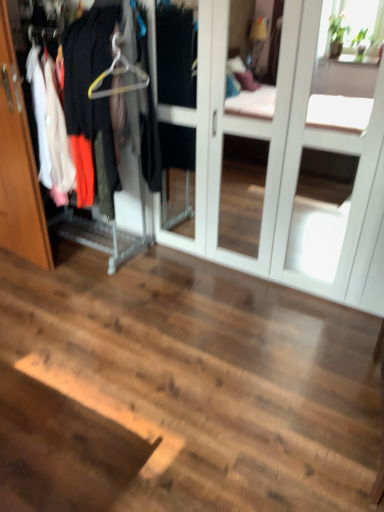
Question: Does wooden door at left have a smaller size compared to metallic hanger at left?

Choices:
 (A) no
 (B) yes

Answer: (B)

Question: Is wooden door at left at the left side of metallic hanger at left?

Choices:
 (A) yes
 (B) no

Answer: (A)

Question: Is wooden door at left positioned behind metallic hanger at left?

Choices:
 (A) no
 (B) yes

Answer: (B)

Question: From the image's perspective, is wooden door at left under metallic hanger at left?

Choices:
 (A) no
 (B) yes

Answer: (B)

Question: Does wooden door at left appear on the right side of metallic hanger at left?

Choices:
 (A) yes
 (B) no

Answer: (B)

Question: Can we say wooden door at left lies outside metallic hanger at left?

Choices:
 (A) yes
 (B) no

Answer: (A)

Question: From the image's perspective, is metallic hanger at left located beneath wooden door at left?

Choices:
 (A) yes
 (B) no

Answer: (B)

Question: Does metallic hanger at left turn towards wooden door at left?

Choices:
 (A) no
 (B) yes

Answer: (B)

Question: Does metallic hanger at left have a lesser width compared to wooden door at left?

Choices:
 (A) yes
 (B) no

Answer: (B)

Question: Is metallic hanger at left turned away from wooden door at left?

Choices:
 (A) yes
 (B) no

Answer: (A)

Question: Can you confirm if metallic hanger at left is taller than wooden door at left?

Choices:
 (A) yes
 (B) no

Answer: (A)

Question: From a real-world perspective, is metallic hanger at left located beneath wooden door at left?

Choices:
 (A) no
 (B) yes

Answer: (A)

Question: Does yellow plastic hanger at upper left have a larger size compared to white glossy screen door at center?

Choices:
 (A) no
 (B) yes

Answer: (A)